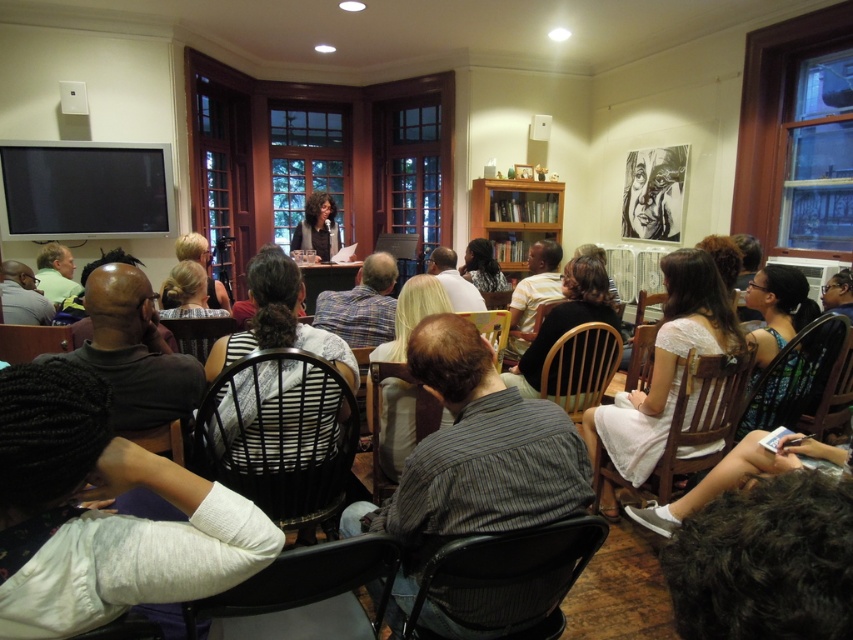
What are the coordinates of `striped fabric shirt at center` in the screenshot? It's located at (473, 458).

You are a GUI agent. You are given a task and a screenshot of the screen. Output one action in this format:
    pyautogui.click(x=<x>, y=<y>)
    Task: Click on the striped fabric shirt at center
    The width and height of the screenshot is (853, 640).
    Given the screenshot: What is the action you would take?
    pyautogui.click(x=473, y=458)

Does white jersey at center have a larger size compared to striped fabric shirt at center?

Actually, white jersey at center might be smaller than striped fabric shirt at center.

Find the location of `white jersey at center`. white jersey at center is located at coordinates (102, 513).

Who is more forward, (233, 540) or (430, 516)?

Point (233, 540) is in front.

The image size is (853, 640). Find the location of `white jersey at center`. white jersey at center is located at coordinates (102, 513).

Who is positioned more to the right, wooden bookshelf at center or black ink drawing of a face at upper right?

black ink drawing of a face at upper right

Can you confirm if wooden bookshelf at center is smaller than black ink drawing of a face at upper right?

Incorrect, wooden bookshelf at center is not smaller in size than black ink drawing of a face at upper right.

Does point (553, 192) come in front of point (625, 212)?

That is False.

The width and height of the screenshot is (853, 640). Find the location of `wooden bookshelf at center`. wooden bookshelf at center is located at coordinates (515, 218).